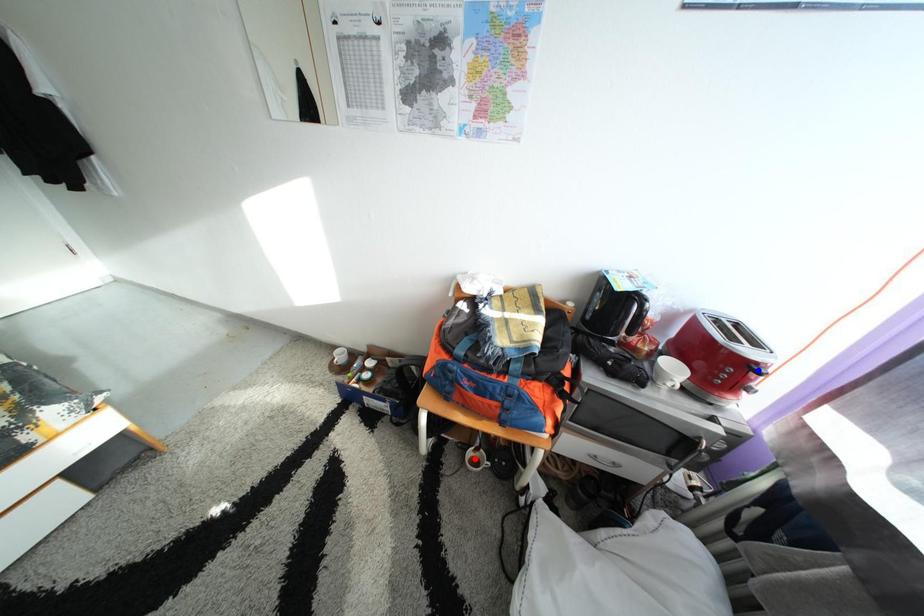
Question: Two points are marked on the image. Which point is closer to the camera?

Choices:
 (A) Blue point is closer.
 (B) Red point is closer.

Answer: (A)